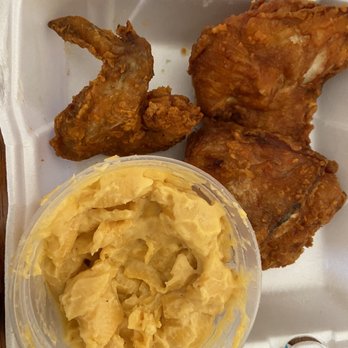
Locate an element on the screen. Image resolution: width=348 pixels, height=348 pixels. box is located at coordinates (49, 101).